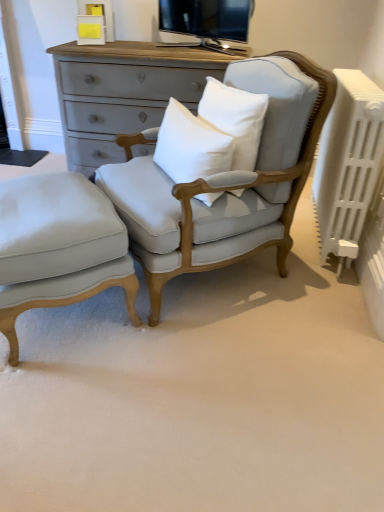
Question: Is the depth of white cotton pillow at center, the first pillow in the left-to-right sequence, greater than that of white cotton pillow at center, the second pillow in the left-to-right sequence?

Choices:
 (A) no
 (B) yes

Answer: (A)

Question: Is white cotton pillow at center, the 2th pillow in the right-to-left sequence, not close to white cotton pillow at center, the second pillow in the left-to-right sequence?

Choices:
 (A) no
 (B) yes

Answer: (A)

Question: Could white cotton pillow at center, the second pillow in the left-to-right sequence, be considered to be inside white cotton pillow at center, the first pillow in the left-to-right sequence?

Choices:
 (A) yes
 (B) no

Answer: (B)

Question: Is white cotton pillow at center, the 2th pillow in the right-to-left sequence, positioned with its back to white cotton pillow at center, which appears as the first pillow when viewed from the right?

Choices:
 (A) yes
 (B) no

Answer: (A)

Question: Does white cotton pillow at center, the 2th pillow in the right-to-left sequence, have a lesser width compared to white cotton pillow at center, which appears as the first pillow when viewed from the right?

Choices:
 (A) yes
 (B) no

Answer: (A)

Question: Is white cotton pillow at center, the first pillow in the left-to-right sequence, smaller than white cotton pillow at center, which appears as the first pillow when viewed from the right?

Choices:
 (A) yes
 (B) no

Answer: (A)

Question: Is light gray fabric ottoman at lower left taller than white plastic radiator at right?

Choices:
 (A) yes
 (B) no

Answer: (B)

Question: Is light gray fabric ottoman at lower left at the left side of white plastic radiator at right?

Choices:
 (A) yes
 (B) no

Answer: (A)

Question: From a real-world perspective, is light gray fabric ottoman at lower left positioned over white plastic radiator at right based on gravity?

Choices:
 (A) no
 (B) yes

Answer: (A)

Question: Does light gray fabric ottoman at lower left lie behind white plastic radiator at right?

Choices:
 (A) yes
 (B) no

Answer: (B)

Question: Is light gray fabric ottoman at lower left surrounding white plastic radiator at right?

Choices:
 (A) no
 (B) yes

Answer: (A)

Question: Does light gray fabric ottoman at lower left have a lesser width compared to white plastic radiator at right?

Choices:
 (A) no
 (B) yes

Answer: (A)

Question: From a real-world perspective, does white cotton pillow at center, the 2th pillow in the right-to-left sequence, sit lower than light gray fabric ottoman at lower left?

Choices:
 (A) yes
 (B) no

Answer: (B)